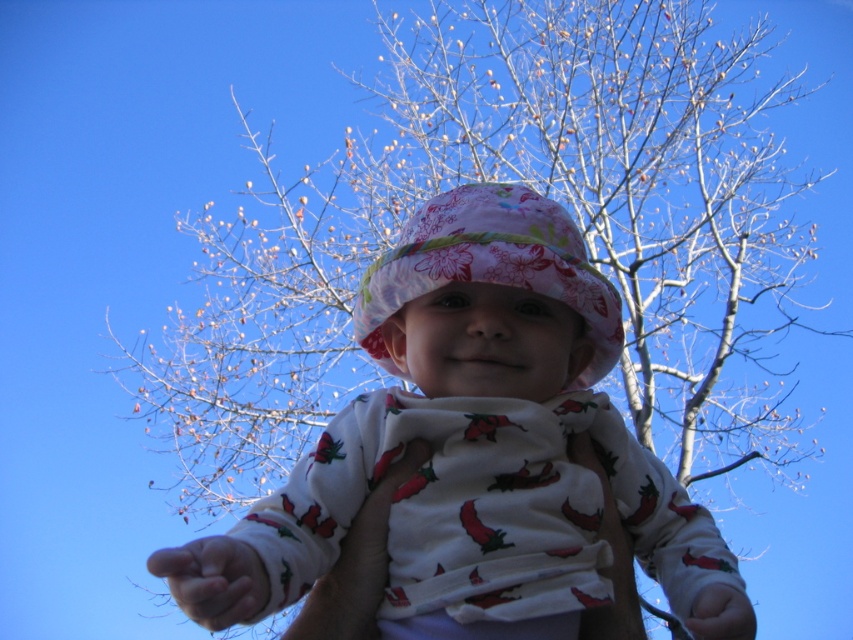
Question: Does floral fabric hat at center appear on the right side of smooth skin hand at lower center?

Choices:
 (A) no
 (B) yes

Answer: (B)

Question: Which object is closer to the camera taking this photo?

Choices:
 (A) smooth skin hand at lower center
 (B) floral fabric hat at center

Answer: (A)

Question: Which point is closer to the camera?

Choices:
 (A) (230, 604)
 (B) (421, 284)

Answer: (A)

Question: Is floral fabric hat at center in front of smooth skin hand at lower center?

Choices:
 (A) yes
 (B) no

Answer: (B)

Question: Does floral fabric hat at center appear under smooth skin hand at lower center?

Choices:
 (A) no
 (B) yes

Answer: (A)